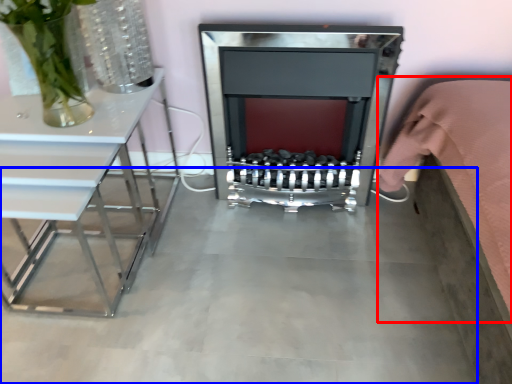
Question: Which object appears closest to the camera in this image, bed (highlighted by a red box) or concrete (highlighted by a blue box)?

Choices:
 (A) bed
 (B) concrete

Answer: (A)